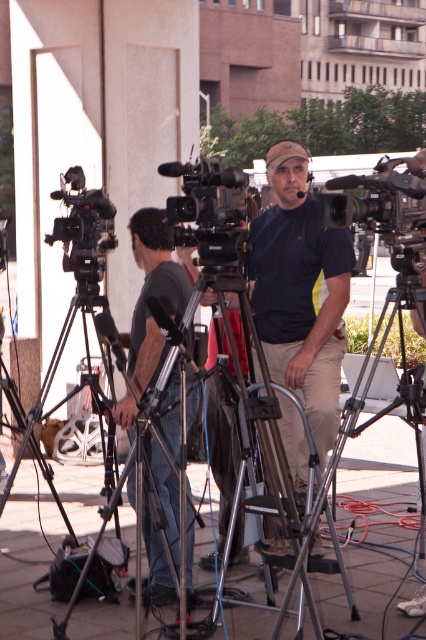
You are standing at the origin point in the scene. Which direction should you move to reach the matte blue shirt at center?

The matte blue shirt at center is located at point 0.458 along the x and 0.707 along the y. Since you are at the origin, you should move northeast to reach it.

You are a photographer setting up equipment for an event. You notice the dark gray fabric shirt at center and the silver metallic tripod at center. Which object takes up more space horizontally in the image?

The silver metallic tripod at center takes up more horizontal space than the dark gray fabric shirt at center because the dark gray fabric shirt at center has a lesser width compared to the silver metallic tripod at center.